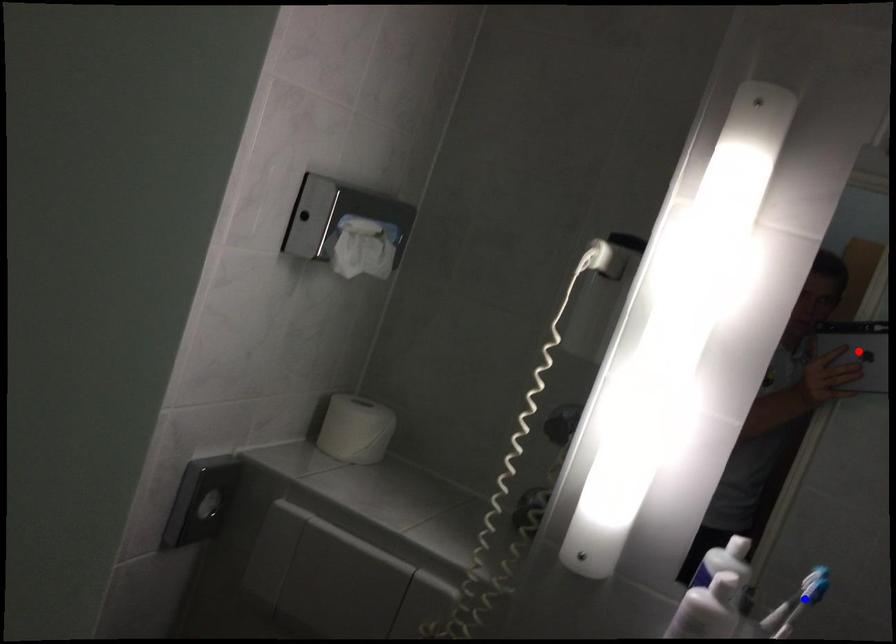
Question: Which of the two points in the image is closer to the camera?

Choices:
 (A) Blue point is closer.
 (B) Red point is closer.

Answer: (B)